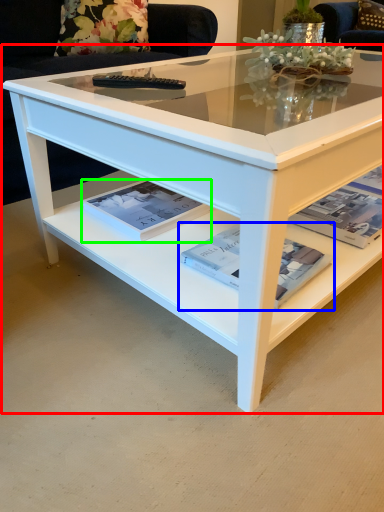
Question: Which is farther away from coffee table (highlighted by a red box)? magazine (highlighted by a blue box) or magazine (highlighted by a green box)?

Choices:
 (A) magazine
 (B) magazine

Answer: (A)